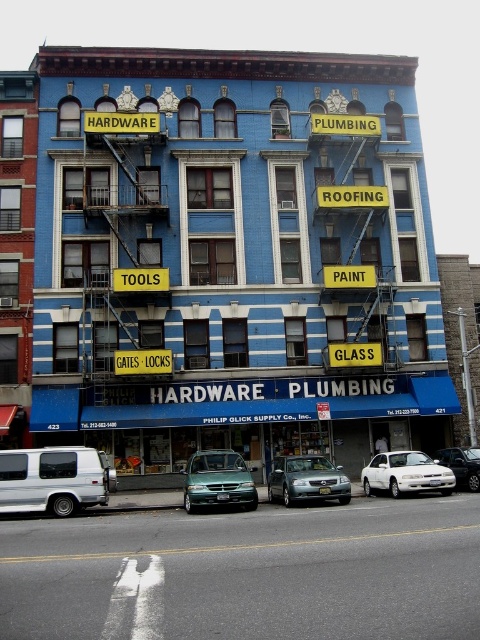
You are a delivery driver who needs to park your green matte van at center near the Philip Glick Supply Co., Inc. building. There is a metallic silver sedan at center already parked there. Since both vehicles are at the same center position, which vehicle takes up less space?

The green matte van at center is smaller than the metallic silver sedan at center, so it takes up less space.

You are a delivery driver who needs to park your silver metallic sedan at center close to the blue brick building at center. Can you park your car directly in front of the building without blocking the entrance?

The blue brick building at center is located above the silver metallic sedan at center, which means the car is already parked directly in front of the building. However, since the building has a ground level entrance, the sedan might be blocking it. Please check the parking regulations or move the car slightly forward to avoid blocking the entrance.